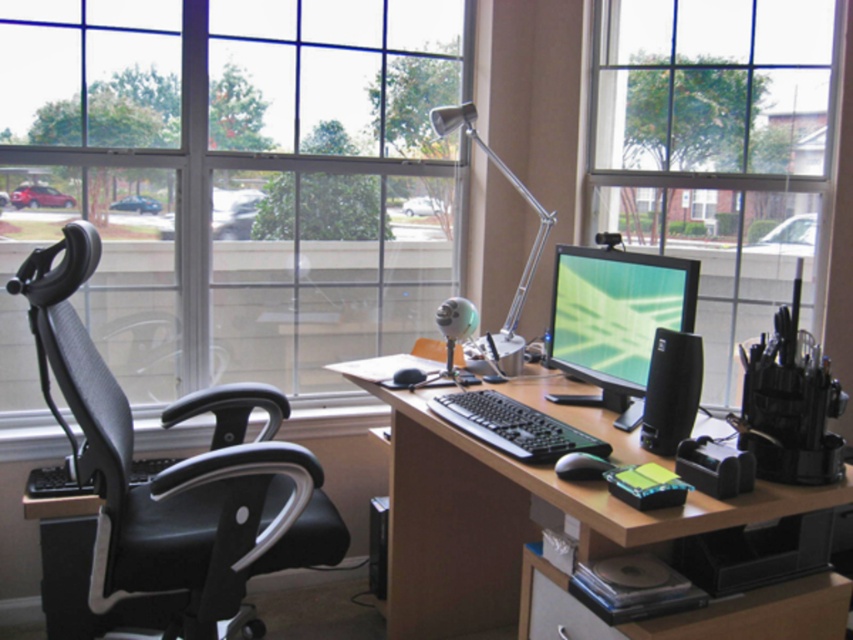
You are setting up a new webcam in your home office and need to position it so that it can capture both the point at coordinates point [335,104] and point [686,272]. Based on the scene description, which point is closer to the front of the room, and therefore should be placed in the foreground of the webcam view?

Point [686,272] is closer to the front of the room and should be placed in the foreground of the webcam view because it is in front of point [335,104] according to the description.

You are an interior designer assessing the home office. You need to determine which of the two windows, the transparent glass window at center or the clear glass window at upper right, allows more natural light into the room based on their height. Which one would you choose?

The transparent glass window at center has a greater height compared to the clear glass window at upper right, so it allows more natural light into the room.

You are sitting in the black mesh swivel chair at left and want to look out the transparent glass window at center. Can you see the window without moving your chair?

The transparent glass window at center is positioned over the black mesh swivel chair at left, so you can see it directly above you without needing to move the chair.